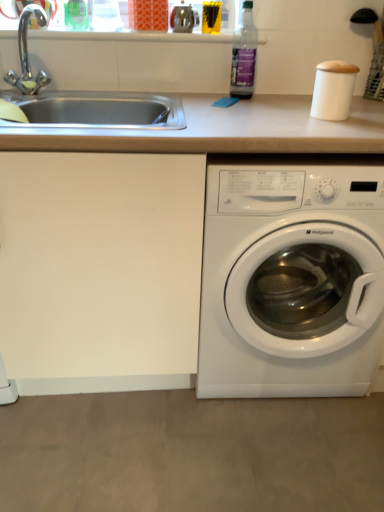
Question: From the image's perspective, is white matte counter top at center located beneath chrome metallic faucet at upper left?

Choices:
 (A) yes
 (B) no

Answer: (A)

Question: Is chrome metallic faucet at upper left completely or partially inside white matte counter top at center?

Choices:
 (A) no
 (B) yes

Answer: (A)

Question: Considering the relative sizes of white matte counter top at center and chrome metallic faucet at upper left in the image provided, is white matte counter top at center taller than chrome metallic faucet at upper left?

Choices:
 (A) yes
 (B) no

Answer: (A)

Question: Would you say white matte counter top at center is a long distance from chrome metallic faucet at upper left?

Choices:
 (A) no
 (B) yes

Answer: (A)

Question: Is white matte counter top at center further to the viewer compared to chrome metallic faucet at upper left?

Choices:
 (A) yes
 (B) no

Answer: (B)

Question: From the image's perspective, relative to transparent plastic bottle at upper right, is white plastic washing machine at lower right above or below?

Choices:
 (A) above
 (B) below

Answer: (B)

Question: Visually, is white plastic washing machine at lower right positioned to the left or to the right of transparent plastic bottle at upper right?

Choices:
 (A) left
 (B) right

Answer: (B)

Question: In the image, is white plastic washing machine at lower right positioned in front of or behind transparent plastic bottle at upper right?

Choices:
 (A) front
 (B) behind

Answer: (A)

Question: Considering the positions of point (241, 167) and point (236, 90), is point (241, 167) closer or farther from the camera than point (236, 90)?

Choices:
 (A) farther
 (B) closer

Answer: (B)

Question: From a real-world perspective, is white matte counter top at center above or below white plastic washing machine at lower right?

Choices:
 (A) above
 (B) below

Answer: (A)

Question: From the image's perspective, relative to white plastic washing machine at lower right, is white matte counter top at center above or below?

Choices:
 (A) below
 (B) above

Answer: (B)

Question: Would you say white matte counter top at center is to the left or to the right of white plastic washing machine at lower right in the picture?

Choices:
 (A) right
 (B) left

Answer: (B)

Question: Do you think white matte counter top at center is within white plastic washing machine at lower right, or outside of it?

Choices:
 (A) outside
 (B) inside

Answer: (B)

Question: Is chrome metallic faucet at upper left situated inside white matte counter top at center or outside?

Choices:
 (A) outside
 (B) inside

Answer: (A)

Question: Is chrome metallic faucet at upper left in front of or behind white matte counter top at center in the image?

Choices:
 (A) behind
 (B) front

Answer: (A)